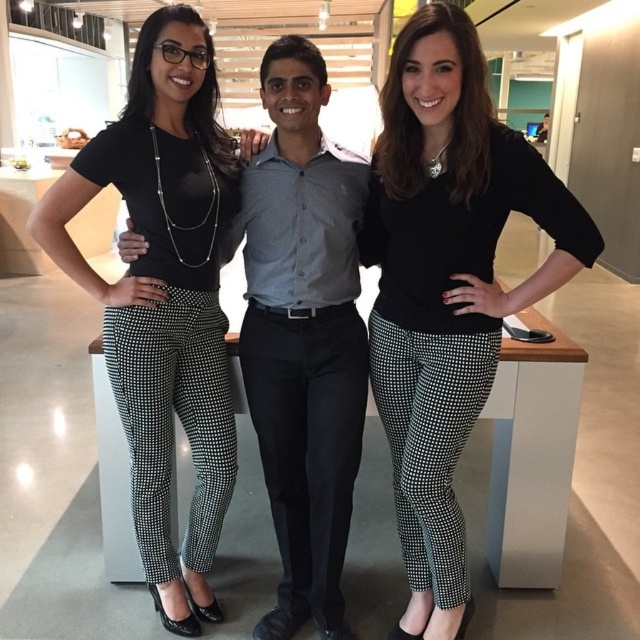
Question: Which of the following is the farthest from the observer?

Choices:
 (A) black textured pants at left
 (B) black textured pants at center

Answer: (A)

Question: Does black textured pants at center have a larger size compared to black textured pants at left?

Choices:
 (A) yes
 (B) no

Answer: (A)

Question: From the image, what is the correct spatial relationship of black textured pants at center in relation to black textured pants at left?

Choices:
 (A) below
 (B) above

Answer: (A)

Question: Can you confirm if black textured pants at center is thinner than black textured pants at left?

Choices:
 (A) no
 (B) yes

Answer: (A)